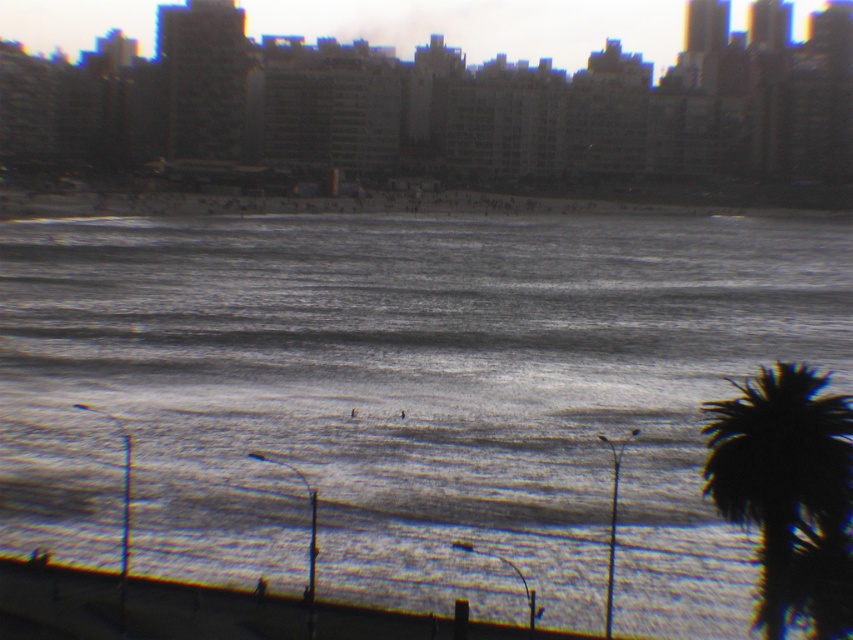
Question: Can you confirm if gray water at center is positioned below smooth concrete wall at lower center?

Choices:
 (A) yes
 (B) no

Answer: (B)

Question: Is gray water at center to the right of dark green leafy palm tree at lower right from the viewer's perspective?

Choices:
 (A) yes
 (B) no

Answer: (B)

Question: Which of these objects is positioned farthest from the dark green leafy palm tree at lower right?

Choices:
 (A) smooth concrete wall at lower center
 (B) gray water at center

Answer: (B)

Question: Which object is closer to the camera taking this photo?

Choices:
 (A) gray water at center
 (B) smooth concrete wall at lower center

Answer: (A)

Question: Based on their relative distances, which object is nearer to the dark green leafy palm tree at lower right?

Choices:
 (A) smooth concrete wall at lower center
 (B) gray water at center

Answer: (A)

Question: In this image, where is gray water at center located relative to dark green leafy palm tree at lower right?

Choices:
 (A) left
 (B) right

Answer: (A)